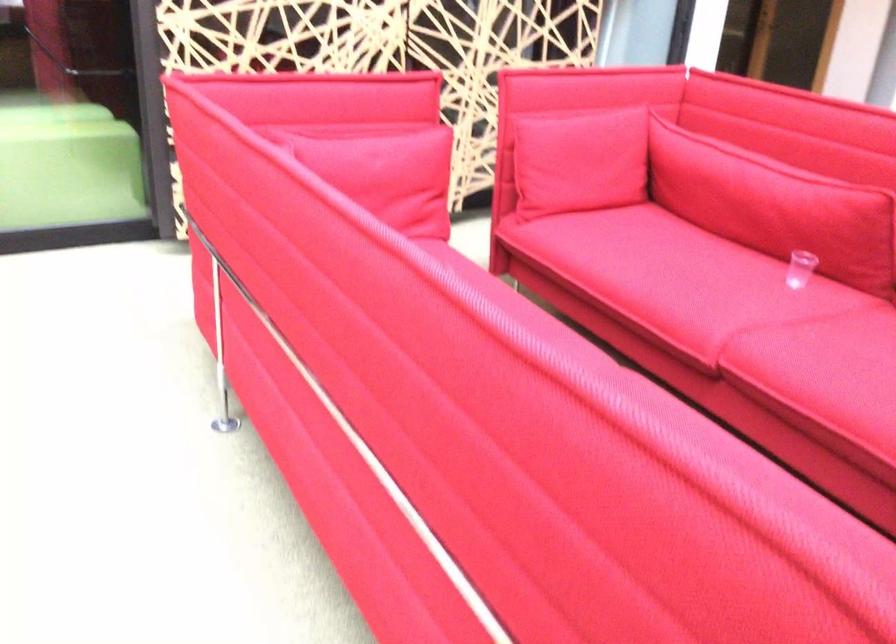
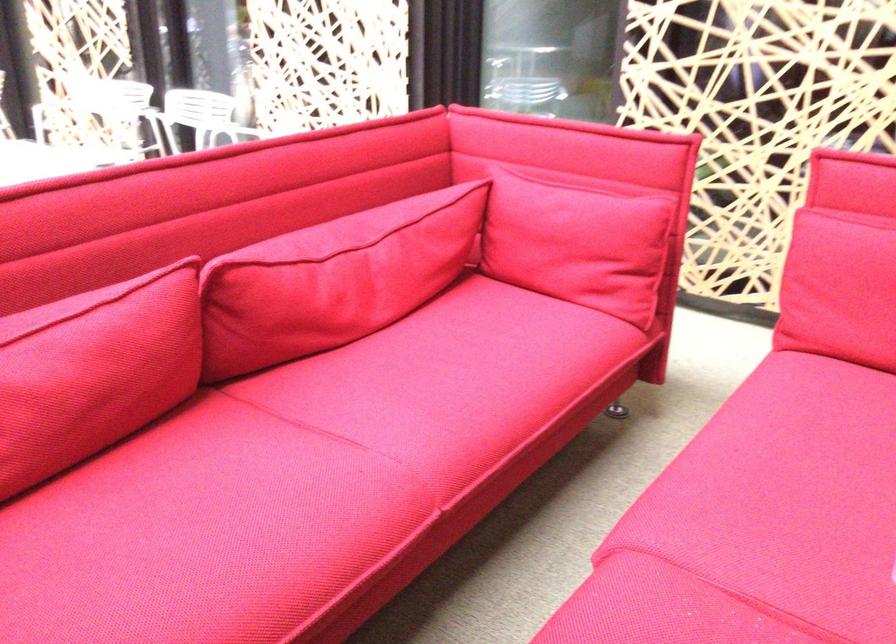
In the second image, find the point that corresponds to the point at 751,294 in the first image.

(759, 522)